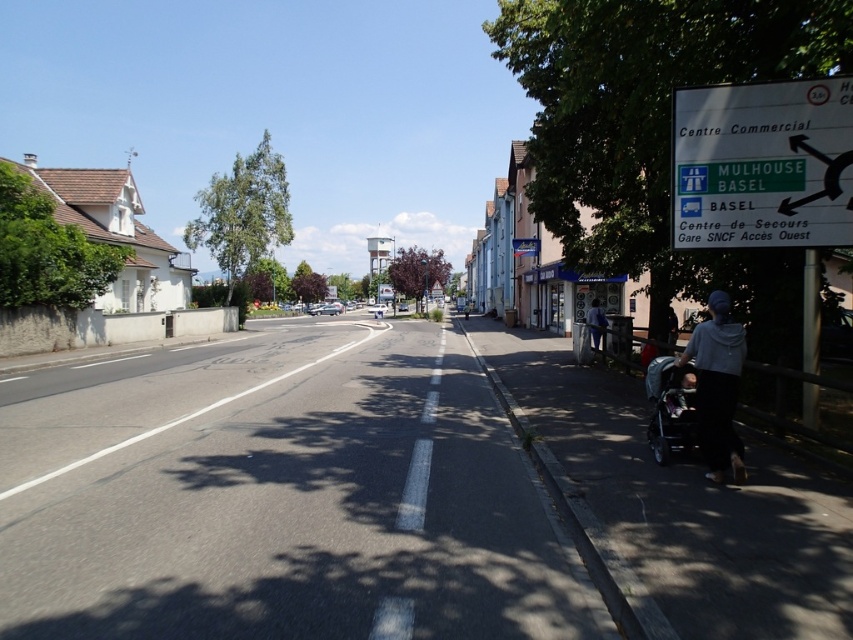
The height and width of the screenshot is (640, 853). Identify the location of gray fabric at lower right. (717, 387).

Between gray fabric at lower right and light blue denim jacket at right, which one is positioned higher?

Positioned higher is light blue denim jacket at right.

Locate an element on the screen. This screenshot has width=853, height=640. gray fabric at lower right is located at coordinates (717, 387).

Identify the location of gray fabric at lower right. (717, 387).

What do you see at coordinates (762, 164) in the screenshot?
I see `white plastic sign at upper right` at bounding box center [762, 164].

Can you confirm if white plastic sign at upper right is shorter than dark gray fabric stroller at lower right?

No.

Who is more forward, (741,138) or (676,385)?

Point (676,385)

Identify the location of white plastic sign at upper right. The width and height of the screenshot is (853, 640). (762, 164).

Between gray fabric at lower right and dark gray fabric stroller at lower right, which one has less height?

dark gray fabric stroller at lower right is shorter.

Can you confirm if gray fabric at lower right is positioned below dark gray fabric stroller at lower right?

Incorrect, gray fabric at lower right is not positioned below dark gray fabric stroller at lower right.

At what (x,y) coordinates should I click in order to perform the action: click on gray fabric at lower right. Please return your answer as a coordinate pair (x, y). This screenshot has width=853, height=640. Looking at the image, I should click on (717, 387).